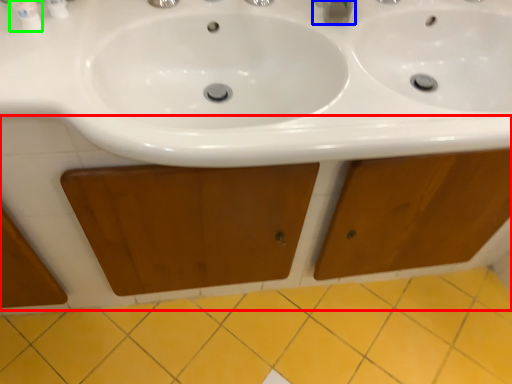
Question: Which object is the farthest from cabinetry (highlighted by a red box)? Choose among these: plumbing fixture (highlighted by a blue box) or mouthwash (highlighted by a green box).

Choices:
 (A) plumbing fixture
 (B) mouthwash

Answer: (A)